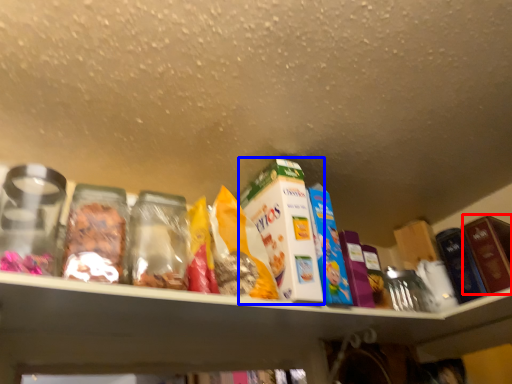
Question: Which object is closer to the camera taking this photo, product (highlighted by a red box) or product (highlighted by a blue box)?

Choices:
 (A) product
 (B) product

Answer: (B)